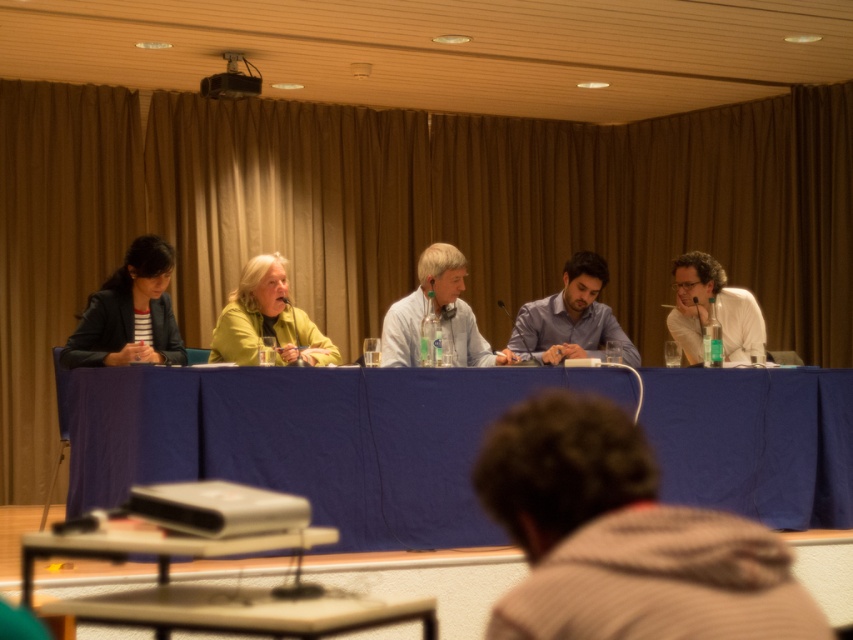
You are sitting at the back of the conference room and want to walk to the front. There are two points marked on the floor in front of you. The first is point (306, 326) and the second is point (730, 340). Which point is closer to the front of the room?

Point (306, 326) is in front of point (730, 340), so it is closer to the front of the room.

Consider the image. You are a photographer standing behind the conference table at the formal meeting. You need to capture a photo that includes both the brown cotton hoodie at lower center and the green matte jacket at center. Based on their positions, which object should you ensure is closer to the bottom of the frame to include both in the shot?

The brown cotton hoodie at lower center is located below the green matte jacket at center, so to include both in the photo, ensure the brown cotton hoodie at lower center is closer to the bottom of the frame.

You are organizing a photo shoot and need to place a small prop between the brown cotton hoodie at lower center and the green matte jacket at center. Given their sizes, which object should the prop be placed closer to?

Result: The prop should be placed closer to the green matte jacket at center because the brown cotton hoodie at lower center occupies less space than the green matte jacket at center, meaning the jacket takes up more area and the prop can be positioned nearer to it without overlapping.